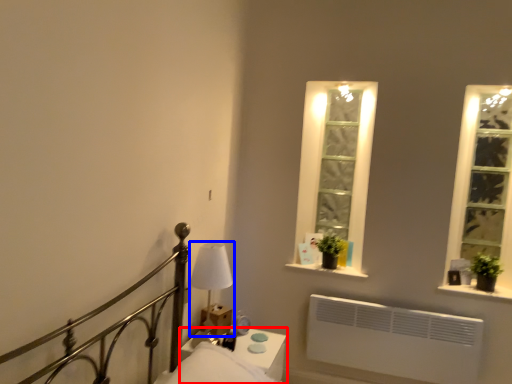
Question: Which object is further to the camera taking this photo, nightstand (highlighted by a red box) or bedside lamp (highlighted by a blue box)?

Choices:
 (A) nightstand
 (B) bedside lamp

Answer: (B)